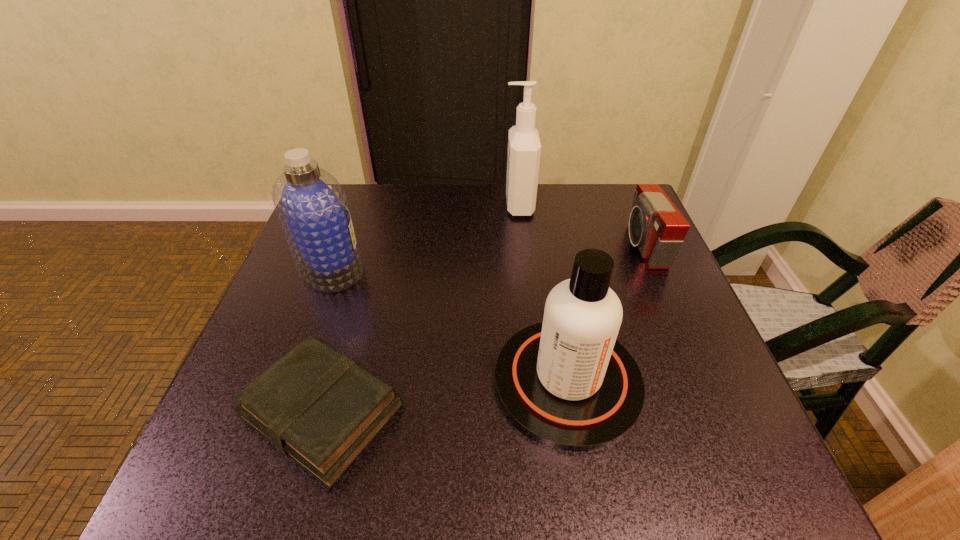
Identify the location of the farthest object. (524, 147).

Image resolution: width=960 pixels, height=540 pixels. I want to click on the leftmost cleansing agent, so click(313, 210).

Where is `the nearest cleansing agent`? The image size is (960, 540). the nearest cleansing agent is located at coordinates (566, 382).

The height and width of the screenshot is (540, 960). Identify the location of the fourth tallest object. (656, 226).

At what (x,y) coordinates should I click in order to perform the action: click on camera. Please return your answer as a coordinate pair (x, y). This screenshot has height=540, width=960. Looking at the image, I should click on (656, 226).

Identify the location of book. (318, 407).

This screenshot has width=960, height=540. Find the location of `vacant area situated 0.320m on the front label of the farthest object`. vacant area situated 0.320m on the front label of the farthest object is located at coordinates (389, 205).

Identify the location of vacant region located on the front label of the farthest object. This screenshot has width=960, height=540. (464, 205).

This screenshot has height=540, width=960. Identify the location of free space located 0.320m on the front label of the farthest object. (389, 205).

In order to click on vacant area located 0.150m on the back of the leftmost cleansing agent in this screenshot , I will do `click(352, 209)`.